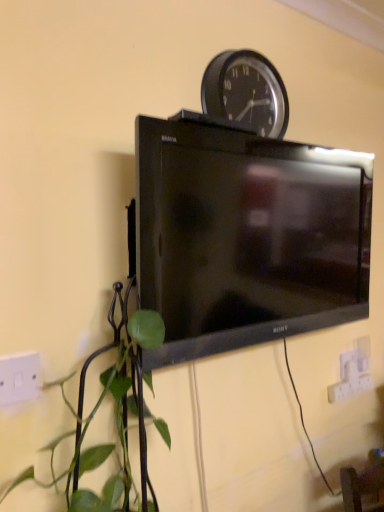
Question: Based on their sizes in the image, would you say black glossy tv at center is bigger or smaller than white plastic electric outlet at lower right, the 1th electric outlet from the right?

Choices:
 (A) big
 (B) small

Answer: (A)

Question: Which is correct: black glossy tv at center is inside white plastic electric outlet at lower right, the 1th electric outlet from the right, or outside of it?

Choices:
 (A) outside
 (B) inside

Answer: (A)

Question: Which is nearer to the white plastic electric outlet at lower right, arranged as the 2th electric outlet when viewed from the front?

Choices:
 (A) white plastic electric outlet at lower left, acting as the first electric outlet starting from the top
 (B) black plastic wall clock at upper center
 (C) black glossy tv at center

Answer: (C)

Question: Which of these objects is positioned farthest from the black plastic wall clock at upper center?

Choices:
 (A) white plastic electric outlet at lower left, the second electric outlet positioned from the back
 (B) black glossy tv at center
 (C) white plastic electric outlet at lower right, which ranks as the first electric outlet in bottom-to-top order

Answer: (C)